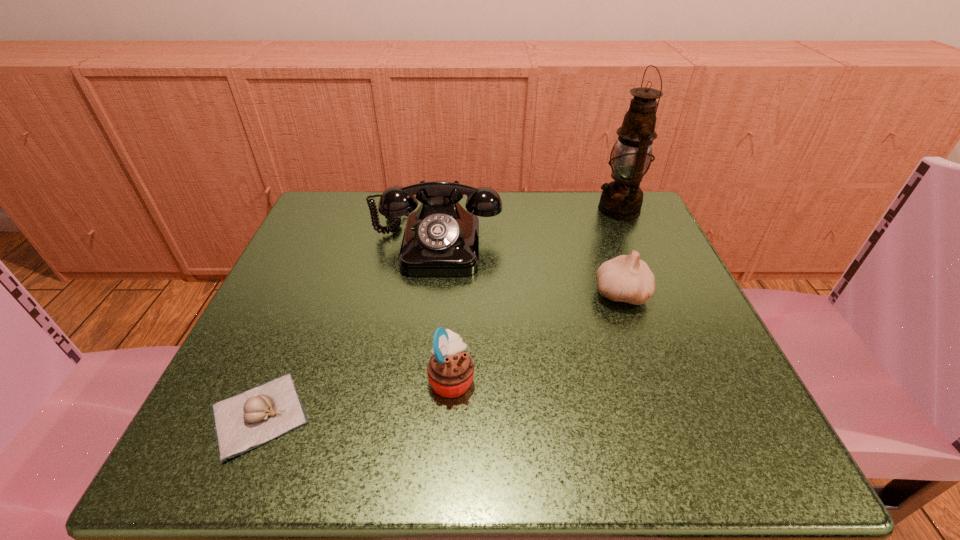
Find the location of `vacant area that lies between the fourth shortest object and the shorter garlic`. vacant area that lies between the fourth shortest object and the shorter garlic is located at coordinates (348, 328).

Find the location of a particular element. The width and height of the screenshot is (960, 540). free space between the fourth shortest object and the muffin is located at coordinates point(444,310).

The height and width of the screenshot is (540, 960). In order to click on free space that is in between the taller garlic and the second tallest object in this screenshot , I will do `click(529, 268)`.

Locate an element on the screen. unoccupied area between the nearer garlic and the fourth shortest object is located at coordinates (348, 328).

Where is `free area in between the oil lamp and the telephone`? Image resolution: width=960 pixels, height=540 pixels. free area in between the oil lamp and the telephone is located at coordinates tap(527, 226).

This screenshot has width=960, height=540. Identify the location of vacant region between the fourth shortest object and the right garlic. (529, 268).

Find the location of a particular element. This screenshot has height=540, width=960. unoccupied position between the muffin and the tallest object is located at coordinates (535, 294).

The width and height of the screenshot is (960, 540). I want to click on object identified as the fourth closest to the telephone, so (622, 199).

Find the location of `the second closest object to the shorter garlic`. the second closest object to the shorter garlic is located at coordinates (441, 238).

This screenshot has width=960, height=540. Identify the location of free spot that satisfies the following two spatial constraints: 1. on the back side of the oil lamp; 2. on the right side of the farther garlic. (592, 209).